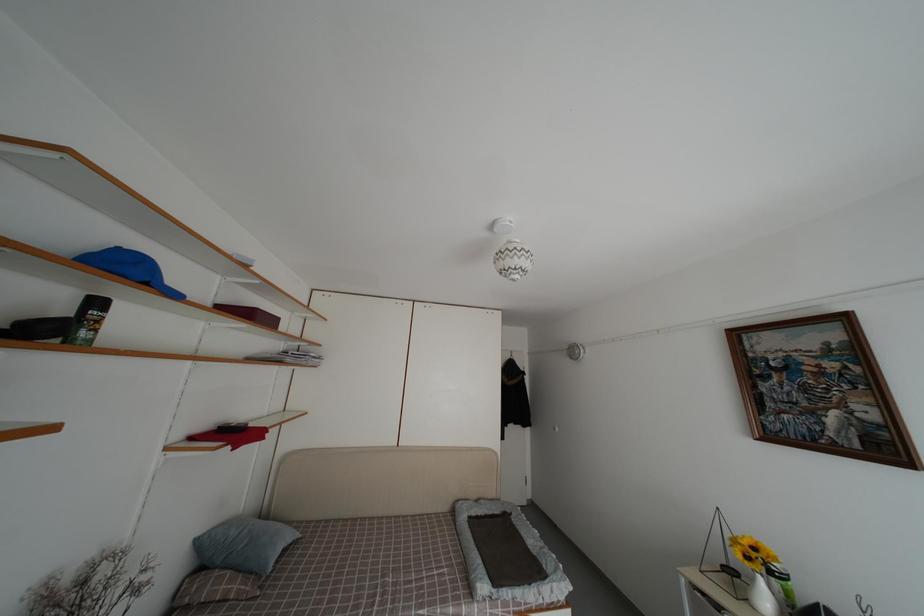
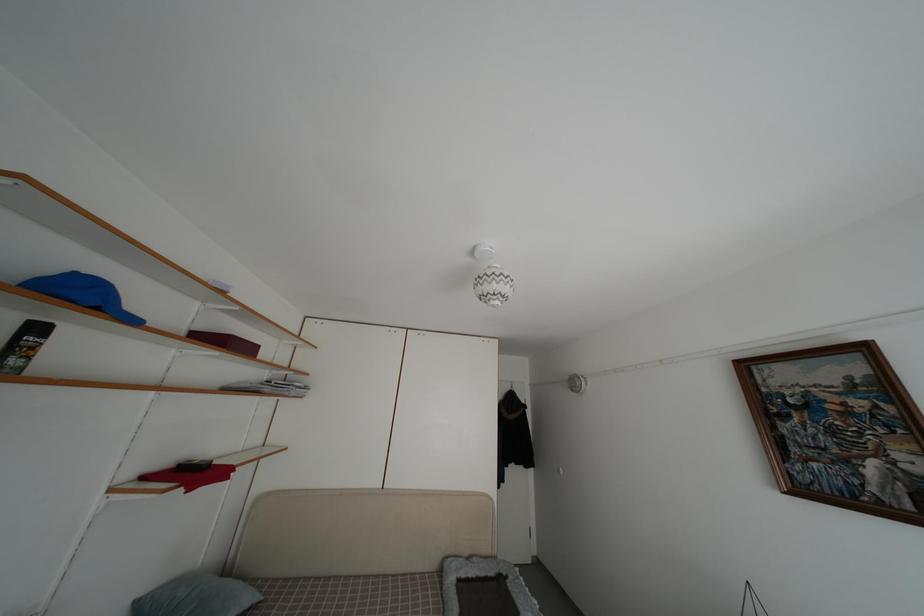
Which direction would the cameraman need to move to produce the second image?

The movement direction of the cameraman is right, forward.